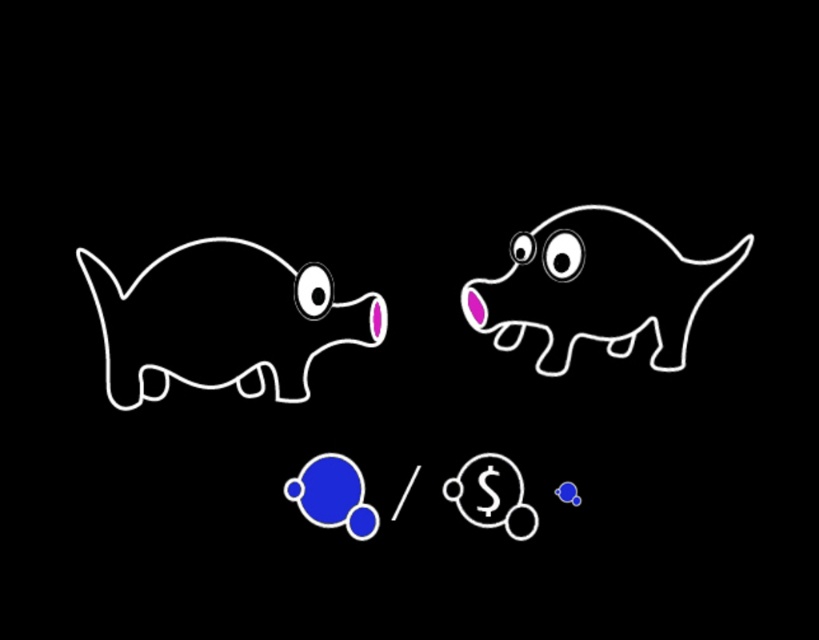
This screenshot has height=640, width=819. I want to click on white outline dog at center, so click(x=586, y=332).

Does white outline dog at center have a larger size compared to white glossy bubble at upper left?

Correct, white outline dog at center is larger in size than white glossy bubble at upper left.

Is point (297, 476) positioned in front of point (299, 268)?

Yes.

At what (x,y) coordinates should I click in order to perform the action: click on white outline dog at center. Please return your answer as a coordinate pair (x, y). Looking at the image, I should click on (586, 332).

Does white glossy dog at upper right have a smaller size compared to pink matte piggy bank at left?

No, white glossy dog at upper right is not smaller than pink matte piggy bank at left.

Between white glossy dog at upper right and pink matte piggy bank at left, which one is positioned higher?

white glossy dog at upper right

Is point (618, 209) more distant than point (88, 252)?

Yes, it is.

Where is `white glossy dog at upper right`? This screenshot has height=640, width=819. white glossy dog at upper right is located at coordinates (586, 332).

Between white glossy dog at upper right and white glossy bubble at upper left, which one has less height?

white glossy bubble at upper left is shorter.

How much distance is there between white glossy dog at upper right and white glossy bubble at upper left?

white glossy dog at upper right and white glossy bubble at upper left are 11.21 inches apart from each other.

Between point (523, 250) and point (313, 307), which one is positioned in front?

Positioned in front is point (523, 250).

The height and width of the screenshot is (640, 819). I want to click on white glossy dog at upper right, so tap(586, 332).